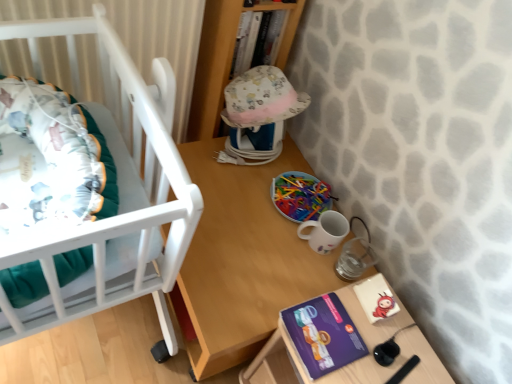
You are a GUI agent. You are given a task and a screenshot of the screen. Output one action in this format:
    pyautogui.click(x=<x>, y=<y>)
    Task: Click on the free space above purple cardboard box at lower right (from a real-world perspective)
    This screenshot has height=384, width=512.
    Given the screenshot: What is the action you would take?
    pyautogui.click(x=366, y=332)